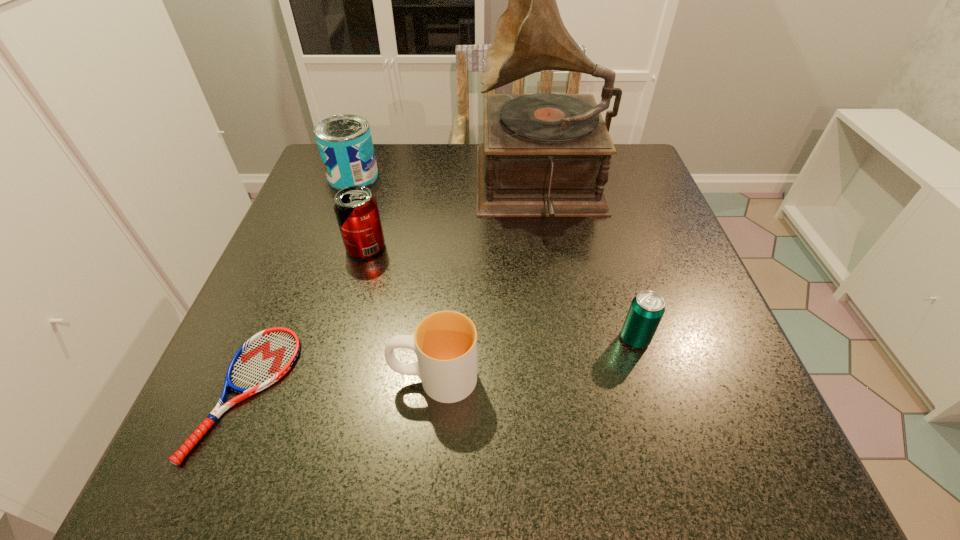
Image resolution: width=960 pixels, height=540 pixels. In order to click on the tallest object in this screenshot , I will do `click(544, 154)`.

Where is `can`? can is located at coordinates (345, 144).

The width and height of the screenshot is (960, 540). What are the coordinates of `soda can` in the screenshot? It's located at (356, 209).

Locate an element on the screen. The width and height of the screenshot is (960, 540). cup is located at coordinates [445, 342].

Identify the location of beer can. Image resolution: width=960 pixels, height=540 pixels. (646, 310).

Where is `tennis racket`? The height and width of the screenshot is (540, 960). tennis racket is located at coordinates (266, 357).

At what (x,y) coordinates should I click in order to perform the action: click on vacant space situated from the horn of the tallest object. Please return your answer as a coordinate pair (x, y). Image resolution: width=960 pixels, height=540 pixels. Looking at the image, I should click on (341, 186).

The image size is (960, 540). Find the location of `free location located from the horn of the tallest object`. free location located from the horn of the tallest object is located at coordinates (387, 186).

The image size is (960, 540). Find the location of `free space located from the horn of the tallest object`. free space located from the horn of the tallest object is located at coordinates (353, 186).

You are a GUI agent. You are given a task and a screenshot of the screen. Output one action in this format:
    pyautogui.click(x=<x>, y=<y>)
    Task: Click on the free region located on the front of the can
    The image size is (960, 540).
    Given the screenshot: What is the action you would take?
    pyautogui.click(x=322, y=262)